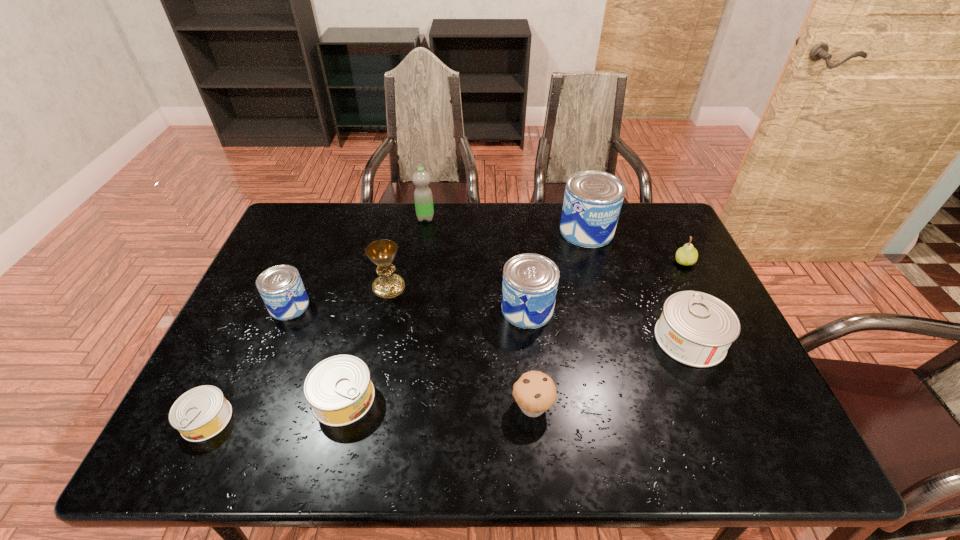
You are a GUI agent. You are given a task and a screenshot of the screen. Output one action in this format:
    pyautogui.click(x=<x>, y=<y>)
    Task: Click on the rightmost can
    The width and height of the screenshot is (960, 540).
    Given the screenshot: What is the action you would take?
    pyautogui.click(x=696, y=329)

Find the location of a particular element. The image size is (960, 540). muffin is located at coordinates tap(535, 392).

Where is `the second biggest silver can`? This screenshot has height=540, width=960. the second biggest silver can is located at coordinates (339, 389).

At what (x,y) coordinates should I click in order to perform the action: click on the second silver can from left to right. Please return your answer as a coordinate pair (x, y). Looking at the image, I should click on 339,389.

You are a GUI agent. You are given a task and a screenshot of the screen. Output one action in this format:
    pyautogui.click(x=<x>, y=<y>)
    Task: Click on the leftmost silver can
    
    Given the screenshot: What is the action you would take?
    (x=201, y=413)

Where is `the smallest silver can`? the smallest silver can is located at coordinates (201, 413).

The image size is (960, 540). I want to click on free point located 0.360m on the left of the water bottle, so click(x=312, y=218).

This screenshot has height=540, width=960. I want to click on free space located on the front label of the biggest blue can, so click(x=602, y=286).

Locate an element on the screen. This screenshot has height=540, width=960. free spot located on the back of the chalice is located at coordinates (395, 258).

Where is `vacant space located 0.200m on the front label of the second biggest blue can`? vacant space located 0.200m on the front label of the second biggest blue can is located at coordinates (429, 309).